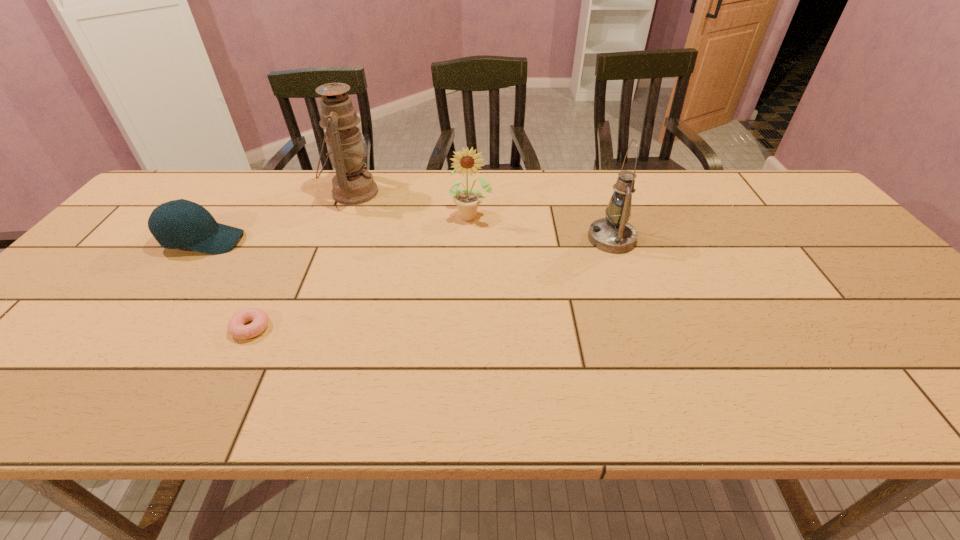
Identify the location of free point between the fourth tallest object and the farther oil lamp. (278, 217).

The width and height of the screenshot is (960, 540). Identify the location of the fourth closest object to the nearest object. (613, 234).

Identify which object is the fourth nearest to the second object from right to left. Please provide its 2D coordinates. Your answer should be formatted as a tuple, i.e. [(x, y)], where the tuple contains the x and y coordinates of a point satisfying the conditions above.

[(178, 224)]

Image resolution: width=960 pixels, height=540 pixels. Identify the location of vacant region that satisfies the following two spatial constraints: 1. on the front-facing side of the fourth object from left to right; 2. on the front-facing side of the leftmost object. (470, 241).

Locate an element on the screen. The height and width of the screenshot is (540, 960). vacant position in the image that satisfies the following two spatial constraints: 1. on the front-facing side of the third shortest object; 2. on the front-facing side of the leftmost object is located at coordinates (470, 241).

The width and height of the screenshot is (960, 540). What are the coordinates of `free space that satisfies the following two spatial constraints: 1. on the front side of the left oil lamp; 2. on the left side of the right oil lamp` in the screenshot? It's located at (335, 239).

Find the location of `free spot that satisfies the following two spatial constraints: 1. on the front-facing side of the fourth object from left to right; 2. on the left side of the shorter oil lamp`. free spot that satisfies the following two spatial constraints: 1. on the front-facing side of the fourth object from left to right; 2. on the left side of the shorter oil lamp is located at coordinates (470, 239).

I want to click on vacant region that satisfies the following two spatial constraints: 1. on the front side of the farther oil lamp; 2. on the left side of the nearer oil lamp, so click(x=335, y=239).

You are a GUI agent. You are given a task and a screenshot of the screen. Output one action in this format:
    pyautogui.click(x=<x>, y=<y>)
    Task: Click on the vacant position in the image that satisfies the following two spatial constraints: 1. on the front-facing side of the third shortest object; 2. on the front-facing side of the fourth tallest object
    
    Given the screenshot: What is the action you would take?
    tap(470, 241)